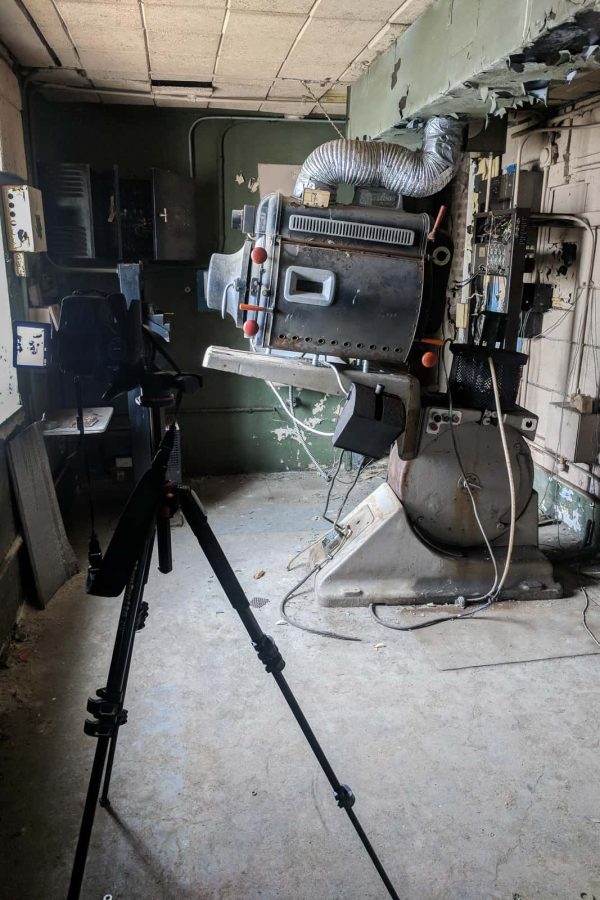
I want to click on vent, so click(x=351, y=165).